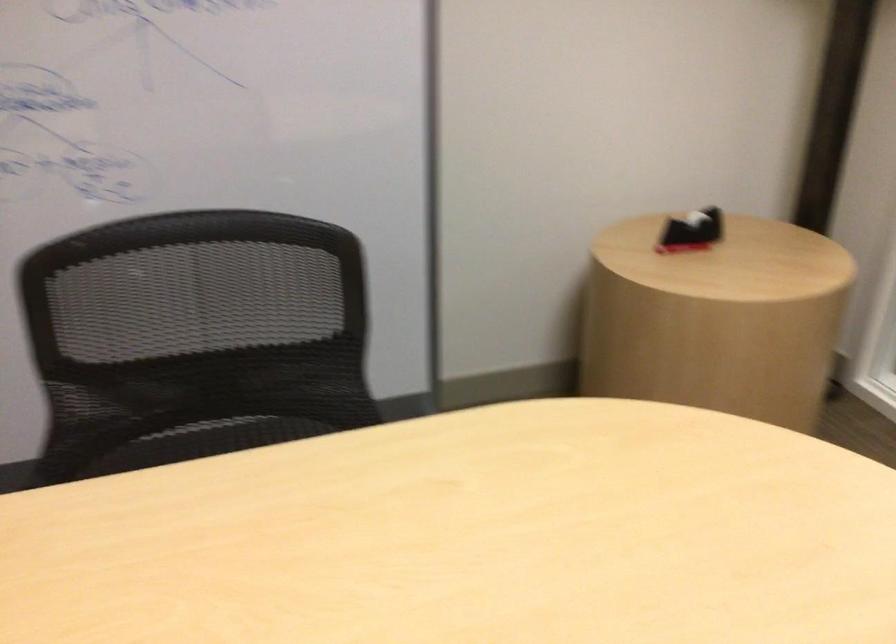
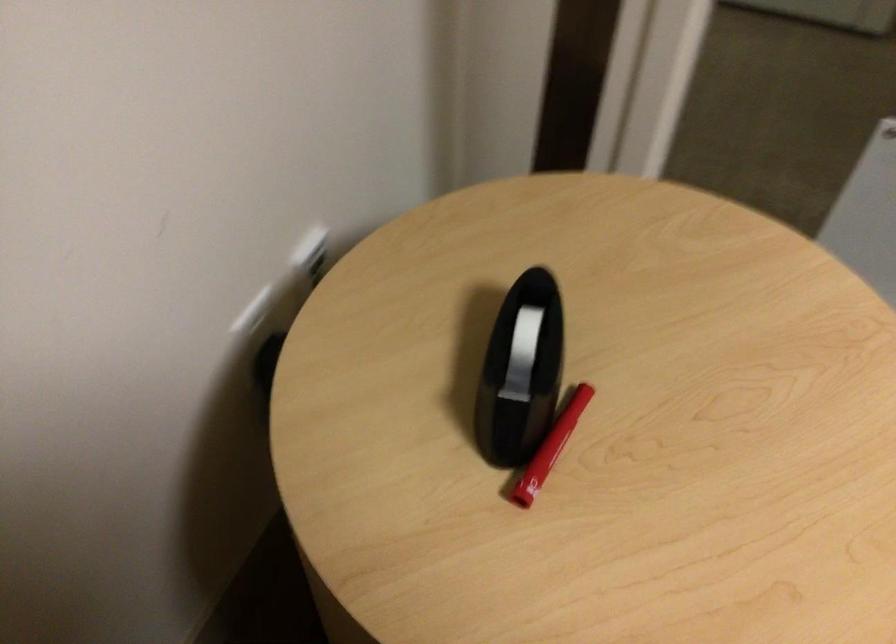
Find the pixel in the second image that matches point 652,254 in the first image.

(527, 511)